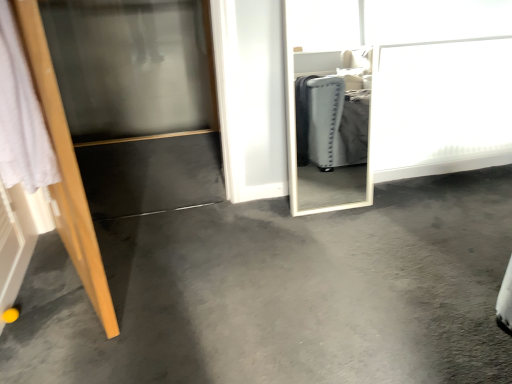
Question: Are wooden door at left and gray carpet at center far apart?

Choices:
 (A) yes
 (B) no

Answer: (B)

Question: Can you confirm if wooden door at left is positioned to the left of gray carpet at center?

Choices:
 (A) no
 (B) yes

Answer: (B)

Question: Is wooden door at left bigger than gray carpet at center?

Choices:
 (A) yes
 (B) no

Answer: (B)

Question: Is wooden door at left shorter than gray carpet at center?

Choices:
 (A) no
 (B) yes

Answer: (A)

Question: Does wooden door at left contain gray carpet at center?

Choices:
 (A) no
 (B) yes

Answer: (A)

Question: Would you say white glossy screen door at upper right, which appears as the 2th screen door when viewed from the left, is inside or outside wooden door at left?

Choices:
 (A) inside
 (B) outside

Answer: (B)

Question: In terms of height, does white glossy screen door at upper right, the 1th screen door positioned from the right, look taller or shorter compared to wooden door at left?

Choices:
 (A) tall
 (B) short

Answer: (B)

Question: From a real-world perspective, is white glossy screen door at upper right, the 1th screen door positioned from the right, physically located above or below wooden door at left?

Choices:
 (A) below
 (B) above

Answer: (A)

Question: Is point tap(446, 122) positioned closer to the camera than point tap(62, 109)?

Choices:
 (A) farther
 (B) closer

Answer: (B)

Question: In terms of size, does gray carpet at center appear bigger or smaller than wooden door at left?

Choices:
 (A) big
 (B) small

Answer: (A)

Question: From the image's perspective, is gray carpet at center positioned above or below wooden door at left?

Choices:
 (A) above
 (B) below

Answer: (B)

Question: Considering the positions of gray carpet at center and wooden door at left in the image, is gray carpet at center wider or thinner than wooden door at left?

Choices:
 (A) wide
 (B) thin

Answer: (A)

Question: Would you say gray carpet at center is inside or outside wooden door at left?

Choices:
 (A) outside
 (B) inside

Answer: (A)

Question: From their relative heights in the image, would you say wooden door at left is taller or shorter than gray carpet at center?

Choices:
 (A) tall
 (B) short

Answer: (A)

Question: From a real-world perspective, relative to gray carpet at center, is wooden door at left vertically above or below?

Choices:
 (A) below
 (B) above

Answer: (B)